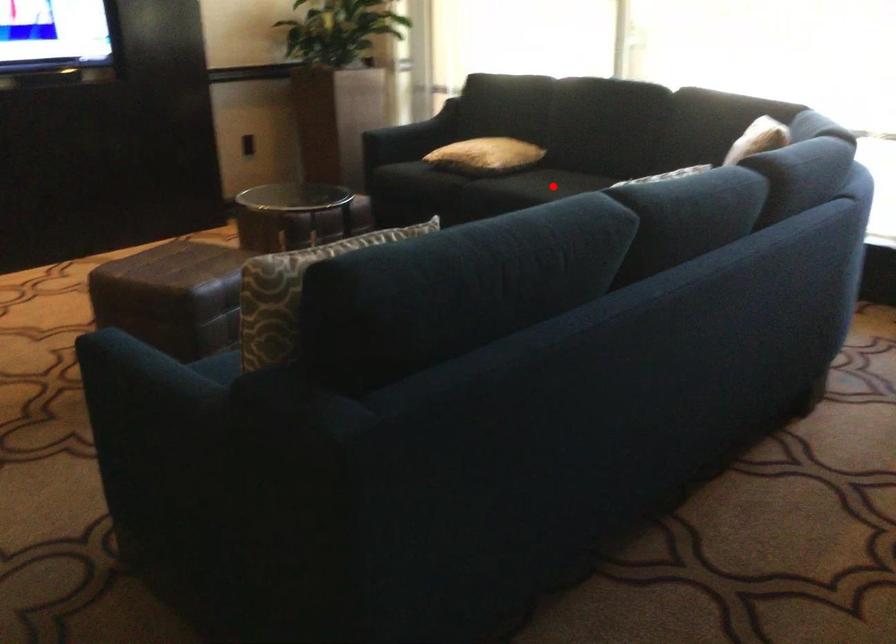
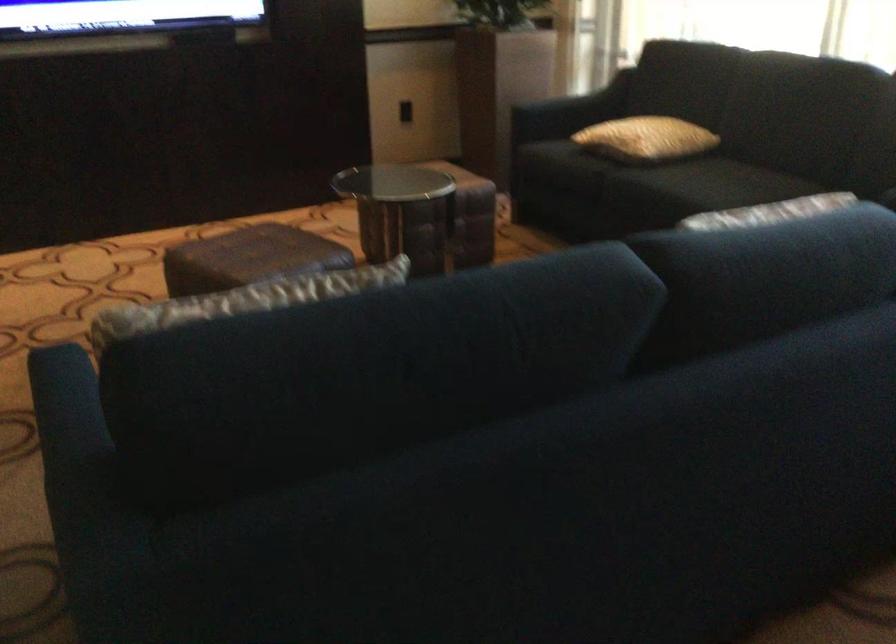
Where in the second image is the point corresponding to the highlighted location from the first image?

(709, 184)